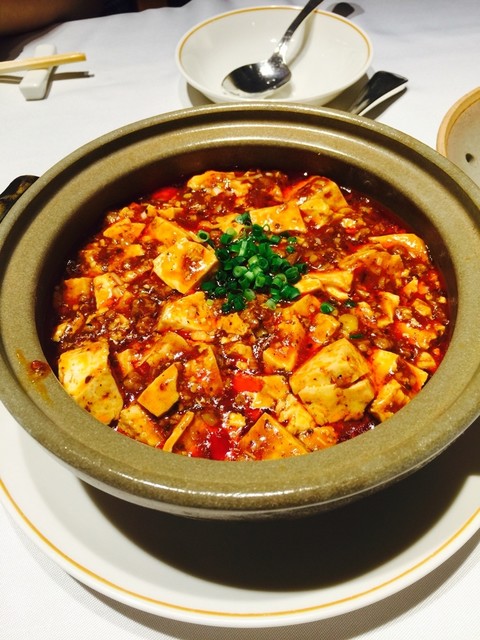
This screenshot has width=480, height=640. In order to click on round white plate in this screenshot , I will do `click(55, 534)`.